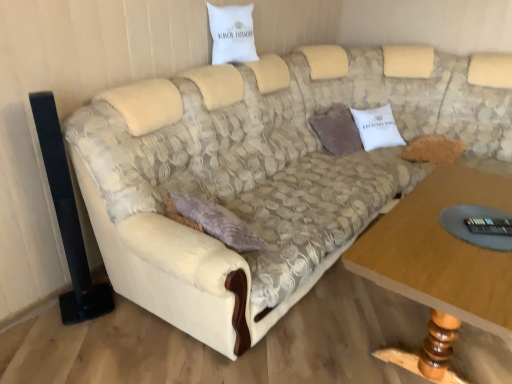
Locate an element on the screen. This screenshot has width=512, height=384. vacant area situated to the left side of transparent glass remote control at lower right is located at coordinates (426, 240).